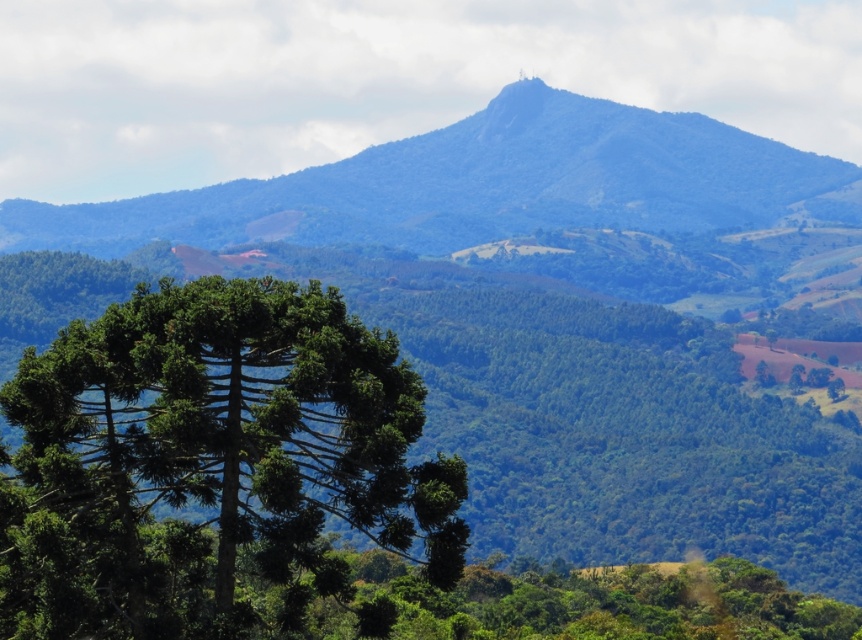
Question: Is green textured tree at center to the left of blue-green textured mountain at upper center from the viewer's perspective?

Choices:
 (A) no
 (B) yes

Answer: (B)

Question: Does green textured tree at center lie in front of blue-green textured mountain at upper center?

Choices:
 (A) yes
 (B) no

Answer: (A)

Question: Which point appears closest to the camera in this image?

Choices:
 (A) (1, 451)
 (B) (83, 225)

Answer: (A)

Question: Which point is closer to the camera?

Choices:
 (A) (241, 440)
 (B) (403, 147)

Answer: (A)

Question: Does green textured tree at center appear on the right side of blue-green textured mountain at upper center?

Choices:
 (A) yes
 (B) no

Answer: (B)